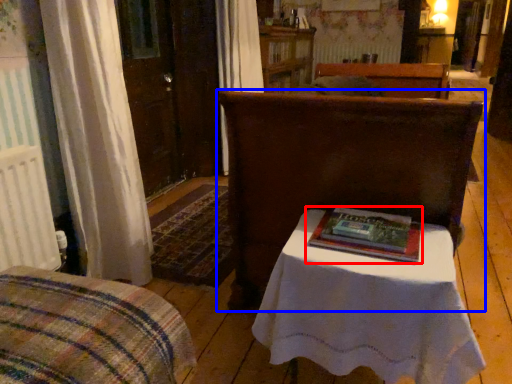
Question: Which object appears closest to the camera in this image, book (highlighted by a red box) or furniture (highlighted by a blue box)?

Choices:
 (A) book
 (B) furniture

Answer: (B)